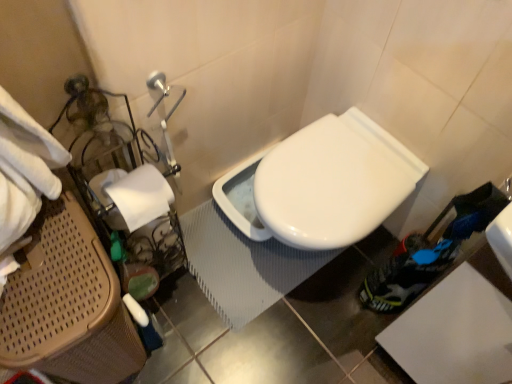
Question: Does white glossy toilet at center have a greater width compared to brown woven laundry basket at left?

Choices:
 (A) yes
 (B) no

Answer: (A)

Question: Is white glossy toilet at center thinner than brown woven laundry basket at left?

Choices:
 (A) yes
 (B) no

Answer: (B)

Question: Is white glossy toilet at center taller than brown woven laundry basket at left?

Choices:
 (A) yes
 (B) no

Answer: (B)

Question: Considering the relative sizes of white glossy toilet at center and brown woven laundry basket at left in the image provided, is white glossy toilet at center bigger than brown woven laundry basket at left?

Choices:
 (A) yes
 (B) no

Answer: (B)

Question: Considering the relative positions of white glossy toilet at center and brown woven laundry basket at left in the image provided, is white glossy toilet at center in front of brown woven laundry basket at left?

Choices:
 (A) no
 (B) yes

Answer: (A)

Question: Is brown woven laundry basket at left in front of or behind white glossy toilet at center in the image?

Choices:
 (A) behind
 (B) front

Answer: (B)

Question: Is brown woven laundry basket at left to the left or to the right of white glossy toilet at center in the image?

Choices:
 (A) left
 (B) right

Answer: (A)

Question: Looking at the image, does brown woven laundry basket at left seem bigger or smaller compared to white glossy toilet at center?

Choices:
 (A) big
 (B) small

Answer: (A)

Question: Considering the positions of point (82, 231) and point (262, 195), is point (82, 231) closer or farther from the camera than point (262, 195)?

Choices:
 (A) closer
 (B) farther

Answer: (A)

Question: From the image's perspective, is white glossy toilet at center above or below brown woven laundry basket at left?

Choices:
 (A) below
 (B) above

Answer: (B)

Question: Considering the positions of white glossy toilet at center and brown woven laundry basket at left in the image, is white glossy toilet at center taller or shorter than brown woven laundry basket at left?

Choices:
 (A) tall
 (B) short

Answer: (B)

Question: From a real-world perspective, is white glossy toilet at center above or below brown woven laundry basket at left?

Choices:
 (A) above
 (B) below

Answer: (B)

Question: In the image, is white glossy toilet at center on the left side or the right side of brown woven laundry basket at left?

Choices:
 (A) right
 (B) left

Answer: (A)

Question: From a real-world perspective, relative to white glossy toilet at center, is white matte toilet paper at left vertically above or below?

Choices:
 (A) below
 (B) above

Answer: (B)

Question: In terms of height, does white matte toilet paper at left look taller or shorter compared to white glossy toilet at center?

Choices:
 (A) tall
 (B) short

Answer: (B)